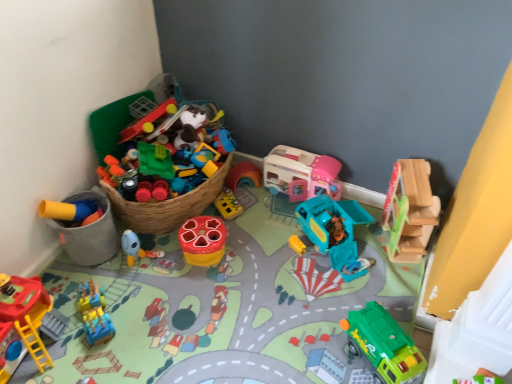
Question: Is blue plastic train at lower left, acting as the seventh toy starting from the right, in front of or behind green matte truck at lower right, which is the 7th toy from left to right, in the image?

Choices:
 (A) front
 (B) behind

Answer: (B)

Question: Is blue plastic train at lower left, placed as the second toy when sorted from left to right, to the left or to the right of green matte truck at lower right, which is the 7th toy from left to right, in the image?

Choices:
 (A) right
 (B) left

Answer: (B)

Question: Based on their relative distances, which object is farther from the wooden slide at upper right, arranged as the first toy when viewed from the right?

Choices:
 (A) teal plastic truck at center, which ranks as the third toy in right-to-left order
 (B) rubberized plastic toy at center, positioned as the fourth toy in left-to-right order
 (C) pink plastic playhouse at upper right, marked as the fifth toy in a left-to-right arrangement
 (D) blue rubber duck at center, which is the 3th toy in left-to-right order
 (E) green matte truck at lower right, which is the 7th toy from left to right

Answer: (D)

Question: Which object is the farthest from the green matte truck at lower right, arranged as the second toy when viewed from the right?

Choices:
 (A) blue plastic train at lower left, placed as the second toy when sorted from left to right
 (B) rubberized yellow toy at left, which appears as the 8th toy when viewed from the right
 (C) blue rubber duck at center, which is the 3th toy in left-to-right order
 (D) rubberized plastic toy at center, which is counted as the 5th toy, starting from the right
 (E) pink plastic playhouse at upper right, acting as the fourth toy starting from the right

Answer: (B)